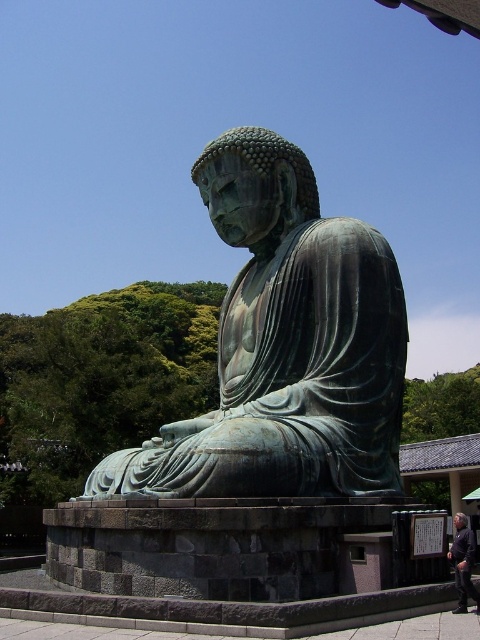
You are a tourist standing at the entrance of the temple and want to take a photo of the green patina statue at center. The temple has a rule that visitors must stay at least 30 meters away from the statue to preserve its historical integrity. Can you safely take your photo from your current position?

The green patina statue at center is 31.94 meters from viewer, so yes, you can safely take the photo from your current position because the distance is more than the required 30 meters.

You are a visitor at the temple and want to take a photo of the green patina statue at center and the dark purple fabric at lower right. Which object should you focus on first if you want to capture both in a single frame without moving the camera?

You should focus on the green patina statue at center first because it occupies less space than the dark purple fabric at lower right, so it will fit better in the frame while still including the larger fabric area.

You are a visitor at the temple and want to place a small offering on the dark purple fabric at lower right. Can you place it directly in front of the green patina statue at center without moving the fabric?

The green patina statue at center is above the dark purple fabric at lower right, so placing the offering directly in front of the statue would also place it on the fabric since the fabric is located below the statue.